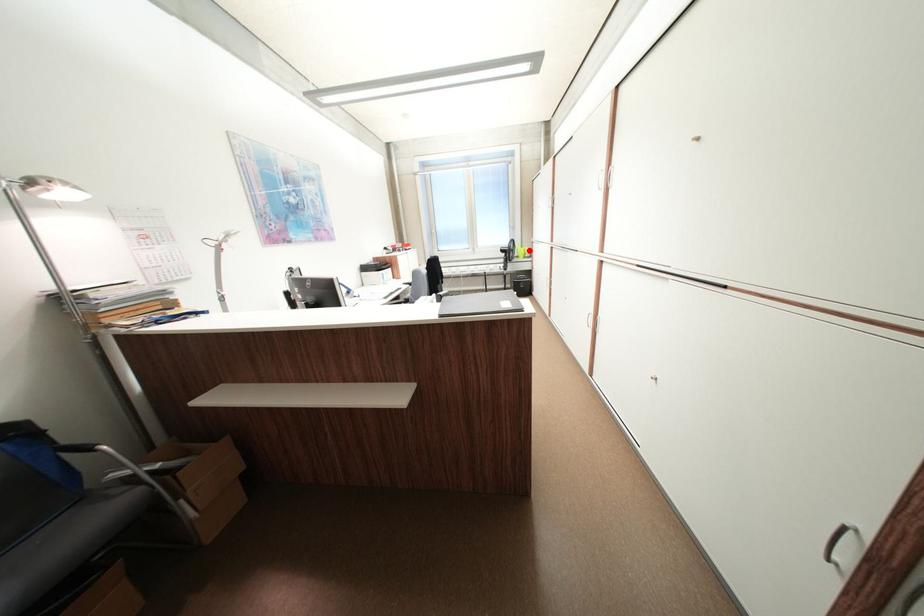
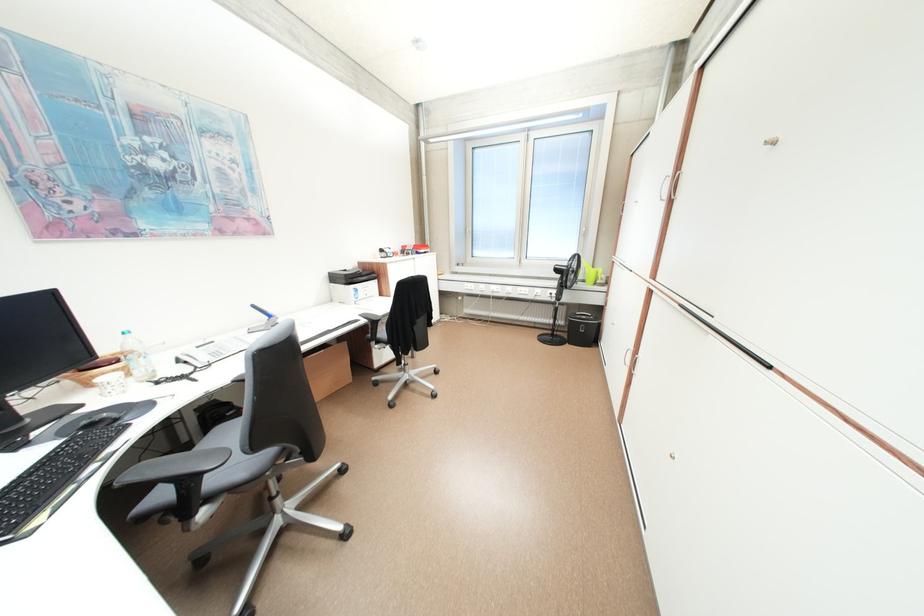
Find the pixel in the second image that matches the highlighted location in the first image.

(598, 273)